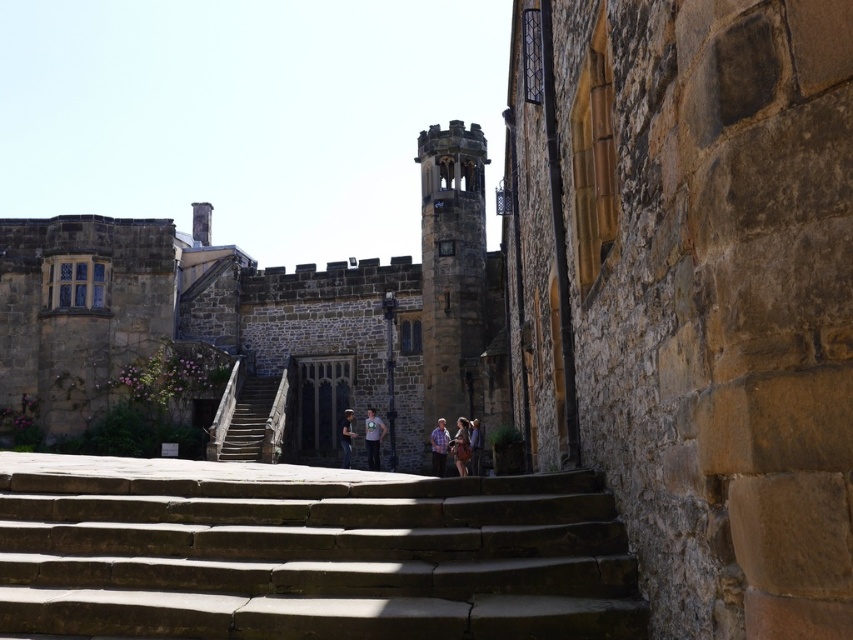
Where is the brown stone tower at center located in the image?

The brown stone tower at center is located at point 0.425 on the x axis and 0.533 on the y axis.

You are standing at the base of the stone steps leading to the historic building. You notice a point marked at coordinates (x=248, y=419). What object is located at this point?

The point at (x=248, y=419) indicates wooden stairs at center.